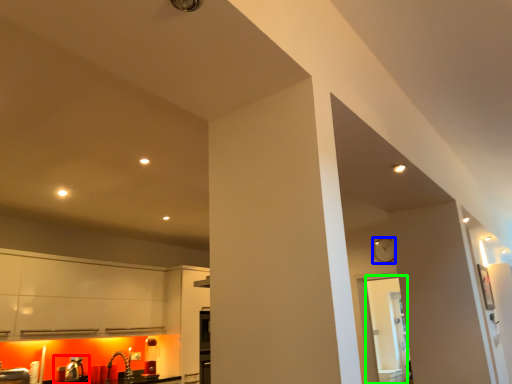
Question: Which object is positioned farthest from sink (highlighted by a red box)? Select from clock (highlighted by a blue box) and glass door (highlighted by a green box).

Choices:
 (A) clock
 (B) glass door

Answer: (B)